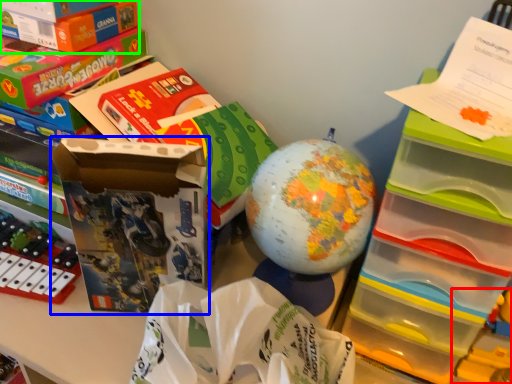
Question: Which is nearer to the toy (highlighted by a red box)? storage box (highlighted by a blue box) or box (highlighted by a green box).

Choices:
 (A) storage box
 (B) box

Answer: (A)